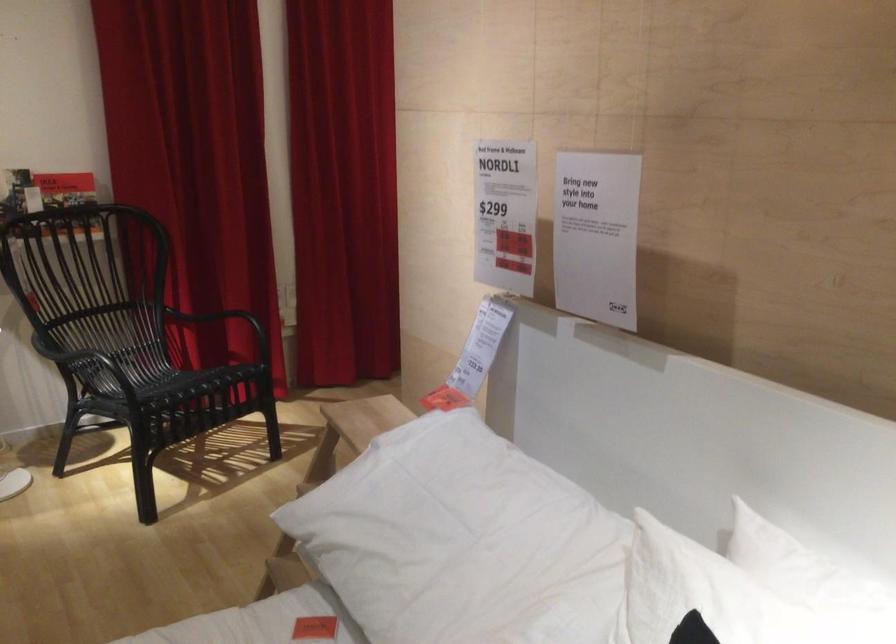
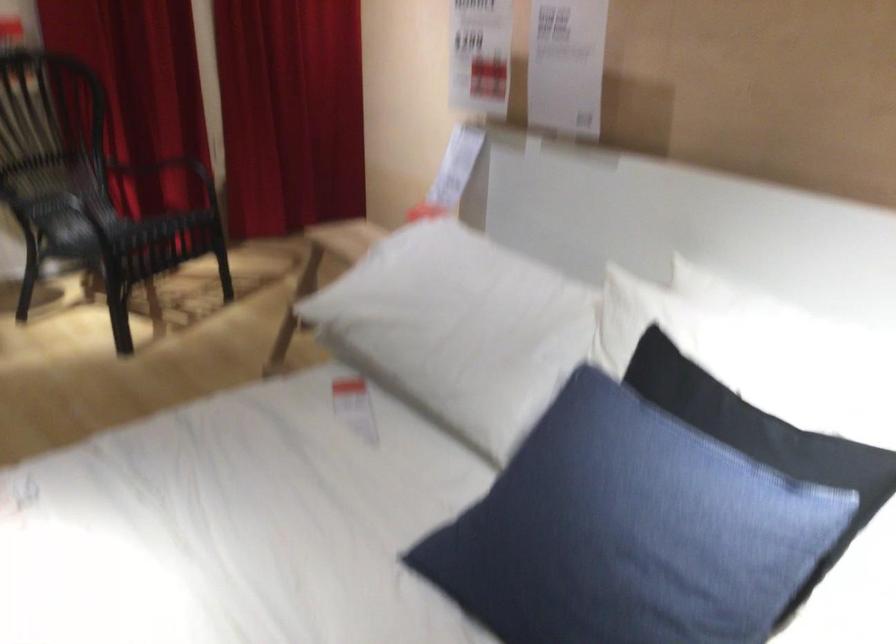
Question: Based on the continuous images, in which direction is the camera rotating? Reply with the corresponding letter.

Choices:
 (A) Left
 (B) Right
 (C) Up
 (D) Down

Answer: (D)